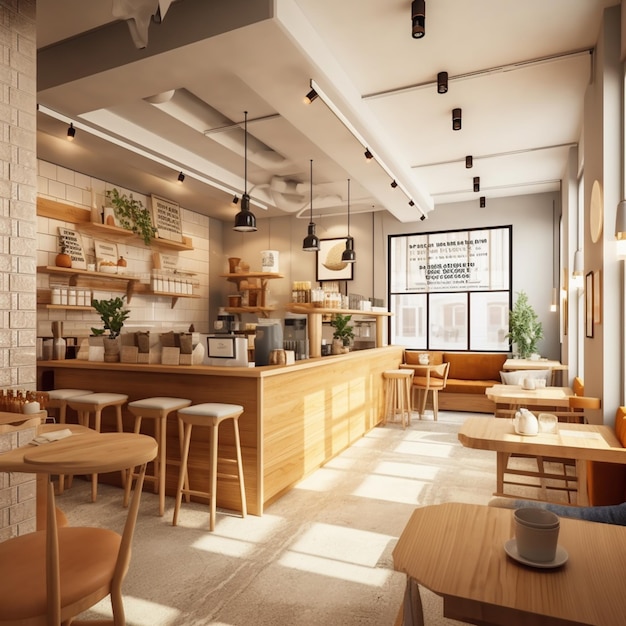
In order to click on stools in this screenshot , I will do 59,394, 94,394, 153,398, 200,408, 398,377.